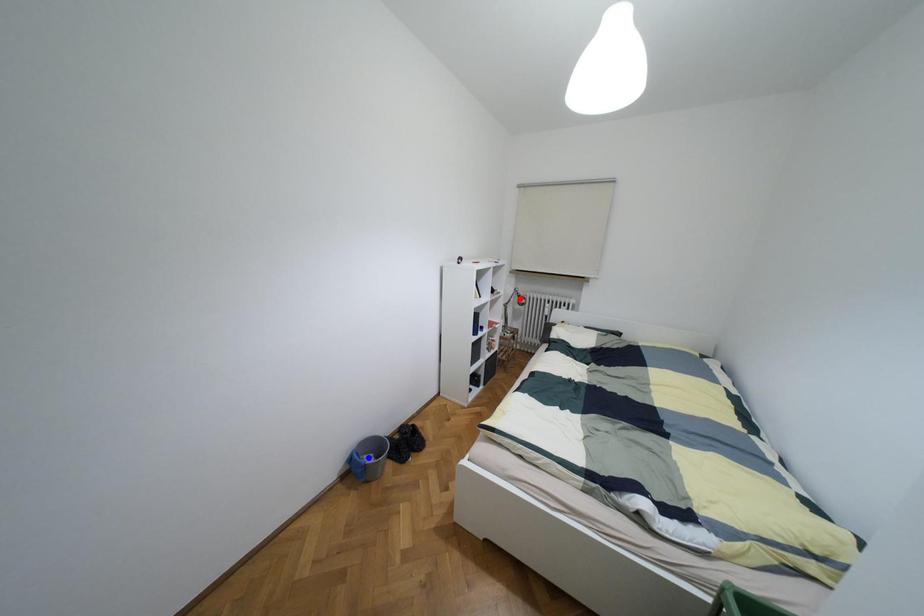
Question: Two points are marked on the image. Which point is closer to the camera?

Choices:
 (A) Blue point is closer.
 (B) Red point is closer.

Answer: (A)